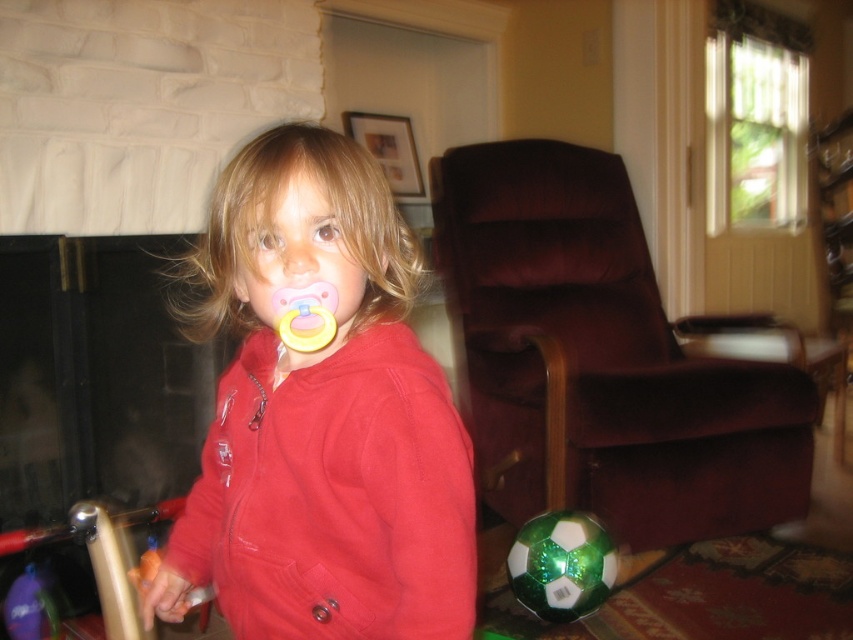
Question: Which of the following is the farthest from the observer?

Choices:
 (A) (808, 497)
 (B) (563, 513)

Answer: (A)

Question: Where is velvet brown armchair at right located in relation to green matte soccer ball at lower right in the image?

Choices:
 (A) left
 (B) right

Answer: (B)

Question: Which point is closer to the camera?

Choices:
 (A) (606, 401)
 (B) (534, 609)

Answer: (B)

Question: Where is green matte soccer ball at lower right located in relation to pink rubber pacifier at center in the image?

Choices:
 (A) right
 (B) left

Answer: (A)

Question: Which point is closer to the camera taking this photo?

Choices:
 (A) (343, 598)
 (B) (276, 308)
 (C) (527, 550)

Answer: (B)

Question: Is velvet brown armchair at right positioned before green matte soccer ball at lower right?

Choices:
 (A) no
 (B) yes

Answer: (A)